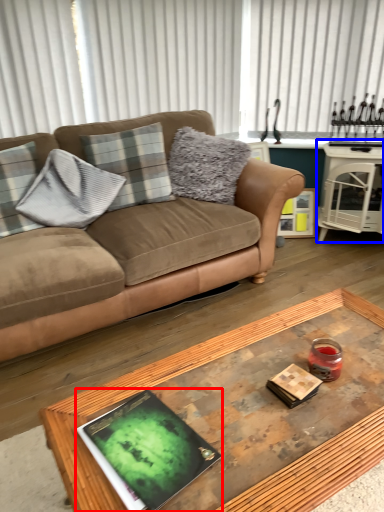
Question: Among these objects, which one is farthest to the camera, magazine (highlighted by a red box) or table (highlighted by a blue box)?

Choices:
 (A) magazine
 (B) table

Answer: (B)